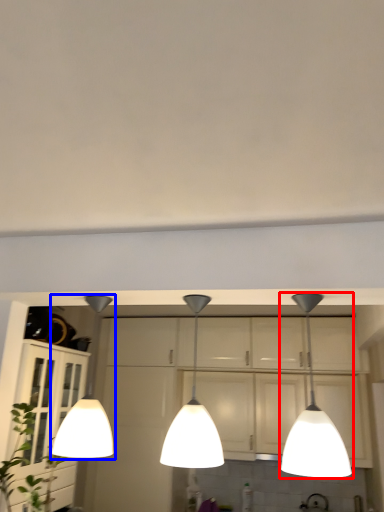
Question: Which of the following is the farthest to the observer, lamp (highlighted by a red box) or lamp (highlighted by a blue box)?

Choices:
 (A) lamp
 (B) lamp

Answer: (B)